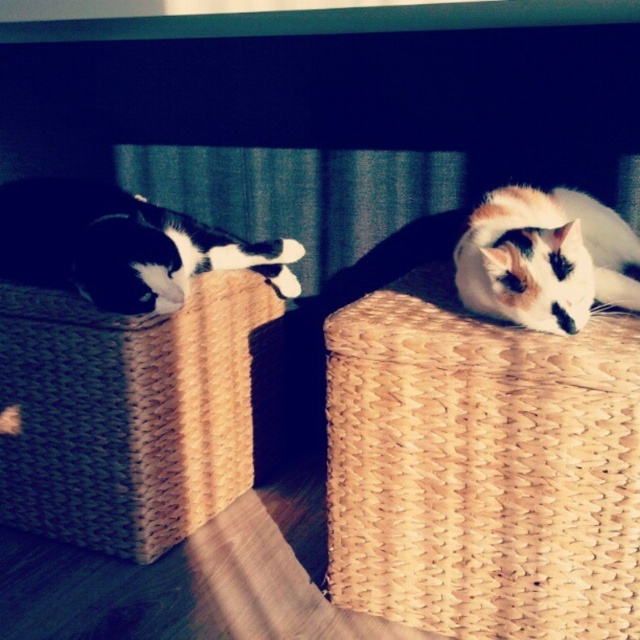
Question: Which of these objects is positioned closest to the black-and-white fur cat at left?

Choices:
 (A) calico fur cat at right
 (B) woven straw basket at upper right

Answer: (B)

Question: Is black-and-white fur cat at left closer to camera compared to calico fur cat at right?

Choices:
 (A) no
 (B) yes

Answer: (A)

Question: Based on their relative distances, which object is nearer to the calico fur cat at right?

Choices:
 (A) woven straw basket at upper right
 (B) woven straw basket at left
 (C) black-and-white fur cat at left

Answer: (A)

Question: Is woven straw basket at left closer to camera compared to black-and-white fur cat at left?

Choices:
 (A) yes
 (B) no

Answer: (B)

Question: Based on their relative distances, which object is nearer to the black-and-white fur cat at left?

Choices:
 (A) calico fur cat at right
 (B) woven straw basket at upper right
 (C) woven straw basket at left

Answer: (C)

Question: Is woven straw basket at left thinner than calico fur cat at right?

Choices:
 (A) yes
 (B) no

Answer: (B)